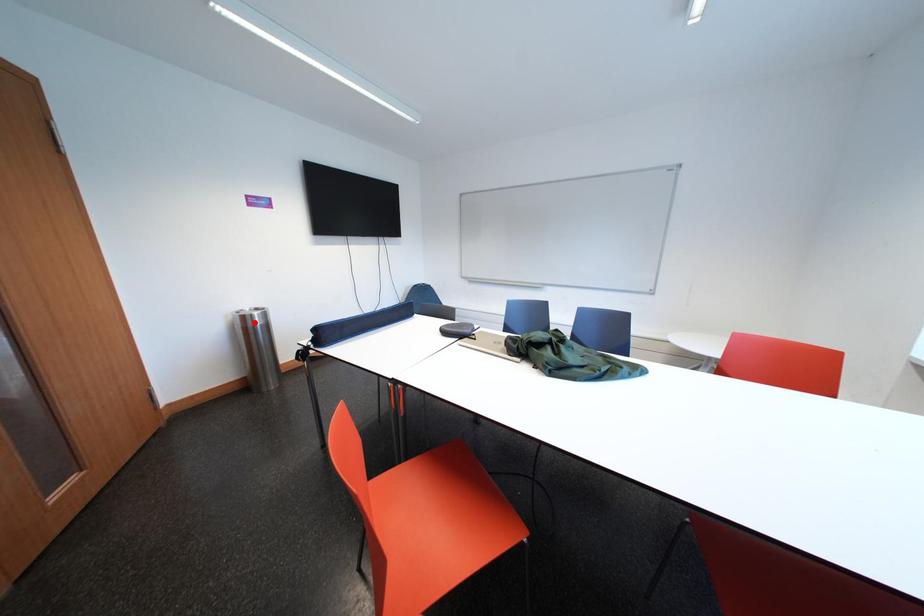
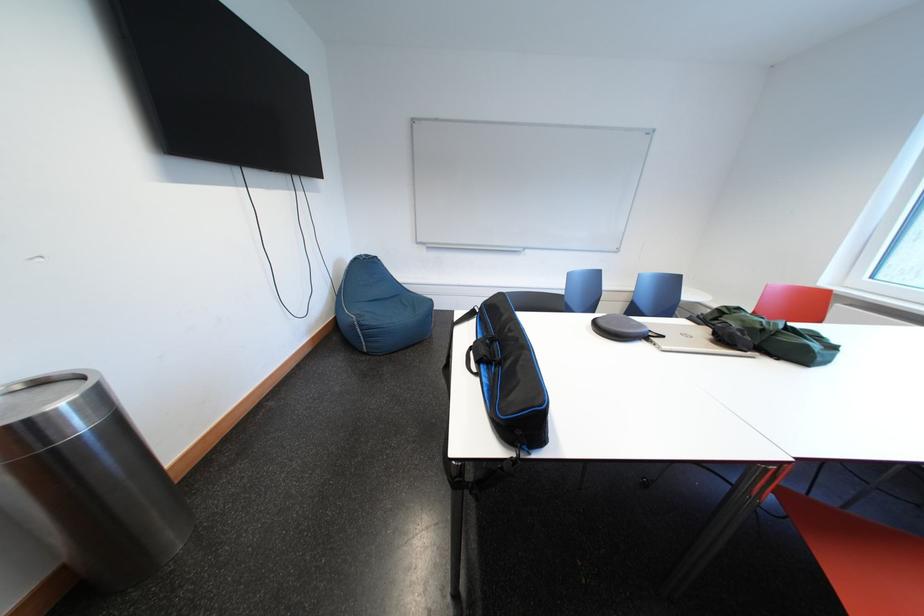
In the second image, find the point that corresponds to the highlighted location in the first image.

(30, 439)